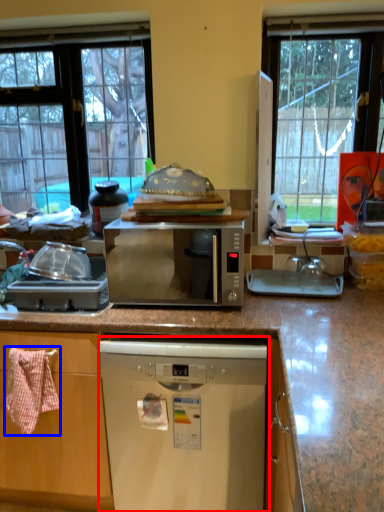
Question: Among these objects, which one is farthest to the camera, dishwasher (highlighted by a red box) or material (highlighted by a blue box)?

Choices:
 (A) dishwasher
 (B) material

Answer: (B)